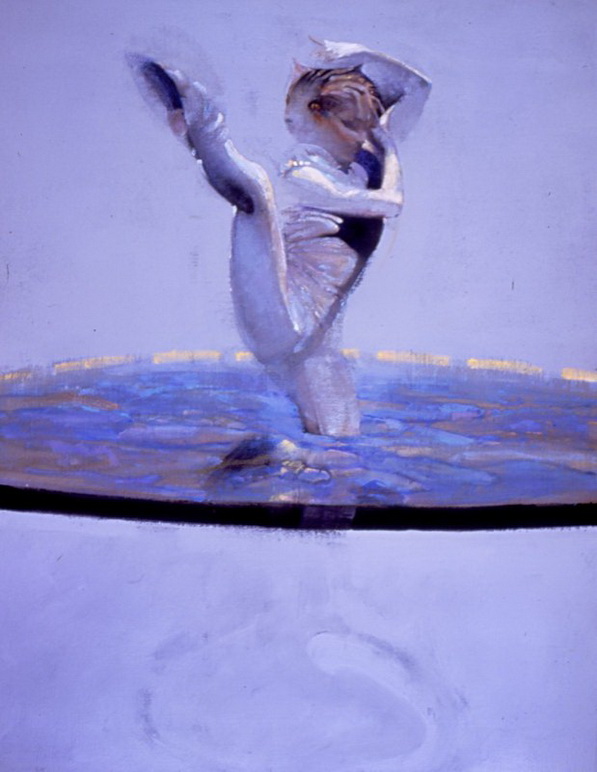
I want to click on candle, so click(440, 476).